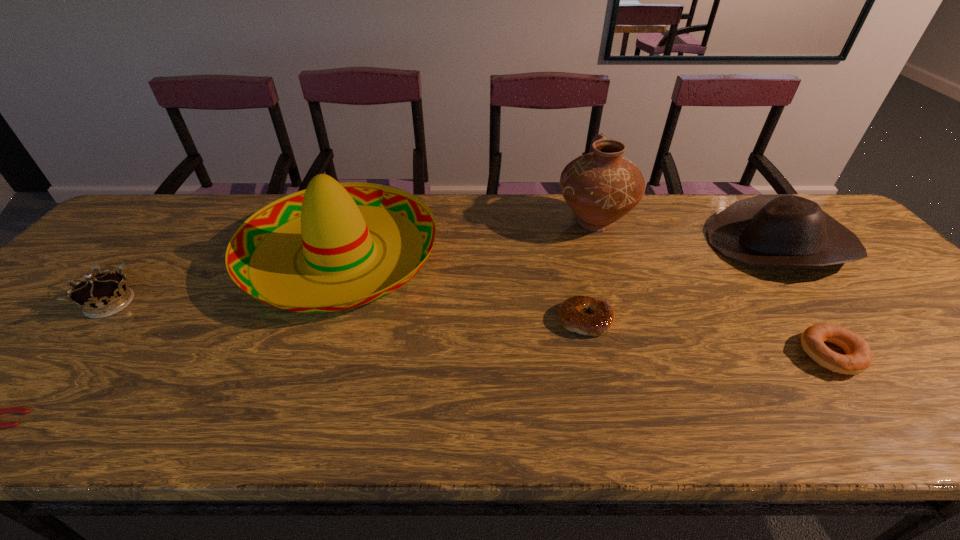
Locate an element on the screen. free spot at the right edge of the desktop is located at coordinates (871, 285).

Find the location of a particular element. The image size is (960, 540). empty space between the fifth shortest object and the crown is located at coordinates (444, 274).

Find the location of `free space between the crown and the right bagel`. free space between the crown and the right bagel is located at coordinates (470, 329).

Where is `vacant space in between the fourth tallest object and the third object from left to right`? Image resolution: width=960 pixels, height=540 pixels. vacant space in between the fourth tallest object and the third object from left to right is located at coordinates (226, 279).

Image resolution: width=960 pixels, height=540 pixels. Identify the location of vacant region between the left bagel and the crown. (348, 312).

Find the location of a particular element. unoccupied area between the pottery and the cowboy hat is located at coordinates (686, 233).

Locate an element on the screen. This screenshot has height=540, width=960. unoccupied position between the pottery and the fifth shortest object is located at coordinates (686, 233).

The height and width of the screenshot is (540, 960). Find the location of `vacant area between the sixth tallest object and the sombrero`. vacant area between the sixth tallest object and the sombrero is located at coordinates (464, 287).

This screenshot has height=540, width=960. I want to click on free area in between the third tallest object and the pottery, so click(x=686, y=233).

The height and width of the screenshot is (540, 960). I want to click on empty space that is in between the cowboy hat and the left bagel, so click(683, 282).